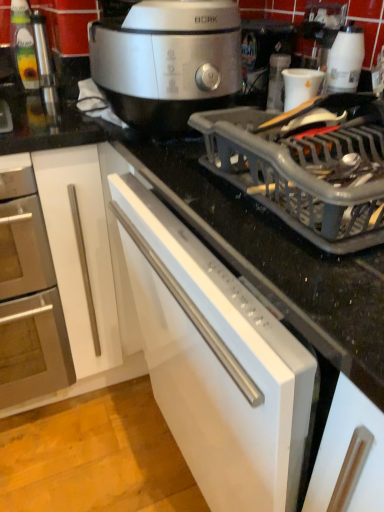
The height and width of the screenshot is (512, 384). What do you see at coordinates (306, 167) in the screenshot?
I see `gray plastic dish rack at upper right` at bounding box center [306, 167].

The image size is (384, 512). In order to click on gray plastic dish rack at upper right in this screenshot , I will do `click(306, 167)`.

What do you see at coordinates (215, 361) in the screenshot? I see `white matte dishwasher at center` at bounding box center [215, 361].

The height and width of the screenshot is (512, 384). Find the location of `white matte dishwasher at center`. white matte dishwasher at center is located at coordinates (215, 361).

The width and height of the screenshot is (384, 512). Describe the element at coordinates (301, 86) in the screenshot. I see `white glossy cup at upper right` at that location.

Where is `white glossy cup at upper right`? white glossy cup at upper right is located at coordinates (301, 86).

What is the approximate width of brushed metal oven at left?

brushed metal oven at left is 62.30 centimeters wide.

The image size is (384, 512). I want to click on gray plastic dish rack at upper right, so click(306, 167).

Which is more to the left, white plastic coffee machine at upper right or gray plastic dish rack at upper right?

white plastic coffee machine at upper right.

From a real-world perspective, between white plastic coffee machine at upper right and gray plastic dish rack at upper right, who is vertically higher?

white plastic coffee machine at upper right is physically above.

Where is `coffee machine that is above the gray plastic dish rack at upper right (from the image's perspective)`? coffee machine that is above the gray plastic dish rack at upper right (from the image's perspective) is located at coordinates (263, 54).

Is white plastic coffee machine at upper right oriented towards gray plastic dish rack at upper right?

No, white plastic coffee machine at upper right does not turn towards gray plastic dish rack at upper right.

Could you tell me if white matte dishwasher at center is turned towards white plastic coffee machine at upper right?

No.

From the image's perspective, does white matte dishwasher at center appear lower than white plastic coffee machine at upper right?

Yes.

Is white matte dishwasher at center shorter than white plastic coffee machine at upper right?

In fact, white matte dishwasher at center may be taller than white plastic coffee machine at upper right.

Can white matte dishwasher at center be found inside gray plastic dish rack at upper right?

That's incorrect, white matte dishwasher at center is not inside gray plastic dish rack at upper right.

Considering the relative sizes of gray plastic dish rack at upper right and white matte dishwasher at center in the image provided, is gray plastic dish rack at upper right smaller than white matte dishwasher at center?

Yes, gray plastic dish rack at upper right is smaller than white matte dishwasher at center.

Is gray plastic dish rack at upper right positioned with its back to white matte dishwasher at center?

No.

From the picture: Visually, is brushed metal oven at left positioned to the left or to the right of white plastic coffee machine at upper right?

brushed metal oven at left is to the left of white plastic coffee machine at upper right.

From the image's perspective, relative to white plastic coffee machine at upper right, is brushed metal oven at left above or below?

Based on their image positions, brushed metal oven at left is located beneath white plastic coffee machine at upper right.

Is brushed metal oven at left oriented towards white plastic coffee machine at upper right?

No, brushed metal oven at left does not turn towards white plastic coffee machine at upper right.

Which is nearer, (x=43, y=358) or (x=343, y=167)?

Clearly, point (x=43, y=358) is more distant from the camera than point (x=343, y=167).

Is gray plastic dish rack at upper right at the back of brushed metal oven at left?

brushed metal oven at left is not turned away from gray plastic dish rack at upper right.

From the image's perspective, is brushed metal oven at left under gray plastic dish rack at upper right?

Yes, from the image's perspective, brushed metal oven at left is below gray plastic dish rack at upper right.

From the picture: Considering the positions of objects brushed metal oven at left and gray plastic dish rack at upper right in the image provided, who is more to the right, brushed metal oven at left or gray plastic dish rack at upper right?

Positioned to the right is gray plastic dish rack at upper right.

Is point (297, 99) positioned before point (20, 248)?

That is True.

Does white glossy cup at upper right turn towards brushed metal oven at left?

No, white glossy cup at upper right is not aimed at brushed metal oven at left.

From the image's perspective, which is above, white glossy cup at upper right or brushed metal oven at left?

Result: white glossy cup at upper right appears higher in the image.

How different are the orientations of white glossy cup at upper right and brushed metal oven at left in degrees?

The facing directions of white glossy cup at upper right and brushed metal oven at left are 90 degrees apart.

Does gray plastic dish rack at upper right turn towards brushed metal oven at left?

No, gray plastic dish rack at upper right is not turned towards brushed metal oven at left.

Locate an element on the screen. This screenshot has width=384, height=512. home appliance below the gray plastic dish rack at upper right (from the image's perspective) is located at coordinates (28, 294).

Are gray plastic dish rack at upper right and brushed metal oven at left far apart?

No.

You are a GUI agent. You are given a task and a screenshot of the screen. Output one action in this format:
    pyautogui.click(x=<x>, y=<y>)
    Task: Click on the kitchen appliance in front of the white plastic coffee machine at upper right
    
    Given the screenshot: What is the action you would take?
    pyautogui.click(x=306, y=167)

The image size is (384, 512). I want to click on coffee machine on the left of white matte dishwasher at center, so click(263, 54).

Estimate the real-world distances between objects in this image. Which object is further from gray plastic dish rack at upper right, brushed metal oven at left or white plastic coffee machine at upper right?

brushed metal oven at left.

Estimate the real-world distances between objects in this image. Which object is further from gray plastic dish rack at upper right, white plastic coffee machine at upper right or white glossy cup at upper right?

The object further to gray plastic dish rack at upper right is white plastic coffee machine at upper right.

From the image, which object appears to be nearer to gray plastic dish rack at upper right, white matte dishwasher at center or white plastic coffee machine at upper right?

The object closer to gray plastic dish rack at upper right is white matte dishwasher at center.

From the picture: Based on their spatial positions, is brushed metal oven at left or white plastic coffee machine at upper right closer to satin silver slow cooker at upper center?

white plastic coffee machine at upper right is positioned closer to the anchor satin silver slow cooker at upper center.

Based on their spatial positions, is brushed metal oven at left or white plastic coffee machine at upper right further from white matte dishwasher at center?

The object further to white matte dishwasher at center is white plastic coffee machine at upper right.

From the image, which object appears to be farther from white matte dishwasher at center, satin silver slow cooker at upper center or white plastic coffee machine at upper right?

Based on the image, white plastic coffee machine at upper right appears to be further to white matte dishwasher at center.

Looking at the image, which one is located closer to white glossy cup at upper right, white matte dishwasher at center or brushed metal oven at left?

Among the two, white matte dishwasher at center is located nearer to white glossy cup at upper right.

When comparing their distances from white matte dishwasher at center, does satin silver slow cooker at upper center or gray plastic dish rack at upper right seem further?

Among the two, satin silver slow cooker at upper center is located further to white matte dishwasher at center.

This screenshot has width=384, height=512. Find the location of `kitchen appliance between satin silver slow cooker at upper center and white matte dishwasher at center in the vertical direction`. kitchen appliance between satin silver slow cooker at upper center and white matte dishwasher at center in the vertical direction is located at coordinates (306, 167).

Find the location of a particular element. appliance between satin silver slow cooker at upper center and white matte dishwasher at center from top to bottom is located at coordinates (301, 86).

This screenshot has height=512, width=384. In order to click on slow cooker situated between brushed metal oven at left and white matte dishwasher at center from left to right in this screenshot , I will do `click(167, 61)`.

Find the location of a particular element. The image size is (384, 512). appliance between brushed metal oven at left and gray plastic dish rack at upper right in the horizontal direction is located at coordinates (301, 86).